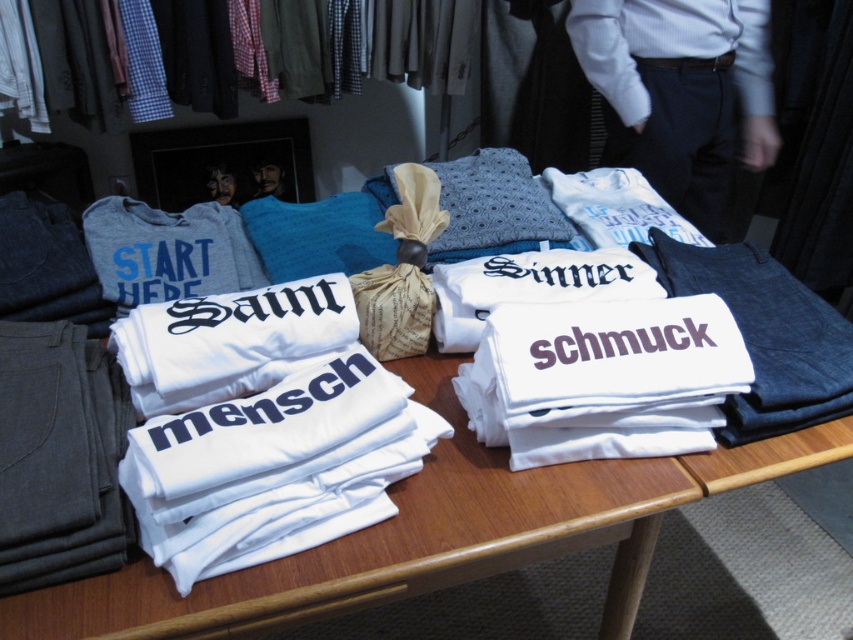
You are a customer in the store and want to find the textured blue pillow at center. According to the coordinates provided, where should you look relative to the wooden table?

The textured blue pillow at center is located at coordinates point (494,205), which is at the center of the scene. Since the wooden table is the focal point in the center, you should look directly at the wooden table to find the textured blue pillow at center.

You are a photographer setting up a shoot in the clothing store. You have a camera and a textured blue pillow at center. How far apart are these two items?

The textured blue pillow at center and camera are 1.11 meters apart.